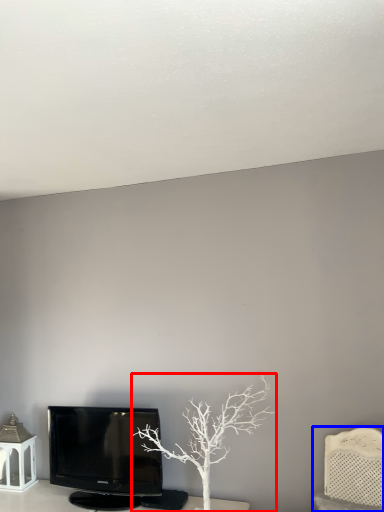
Question: Which object is closer to the camera taking this photo, tree (highlighted by a red box) or furniture (highlighted by a blue box)?

Choices:
 (A) tree
 (B) furniture

Answer: (B)